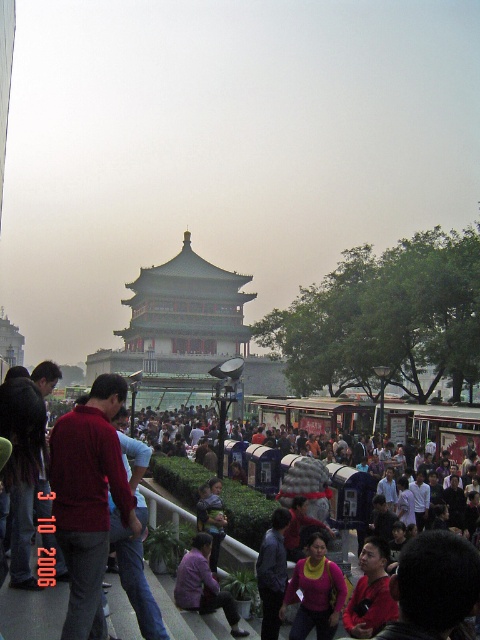
Question: Considering the relative positions of matte pink sweater at center and purple fabric shirt at lower center in the image provided, where is matte pink sweater at center located with respect to purple fabric shirt at lower center?

Choices:
 (A) right
 (B) left

Answer: (A)

Question: Does matte pink sweater at center come behind dark blue jacket at center?

Choices:
 (A) yes
 (B) no

Answer: (B)

Question: Which of the following is the closest to the observer?

Choices:
 (A) (282, 509)
 (B) (356, 586)
 (C) (308, 602)

Answer: (C)

Question: Among these points, which one is farthest from the camera?

Choices:
 (A) (360, 609)
 (B) (180, 596)

Answer: (B)

Question: Does matte pink sweater at center appear under dark blue jacket at center?

Choices:
 (A) no
 (B) yes

Answer: (B)

Question: Which of these objects is positioned closest to the red matte shirt at lower right?

Choices:
 (A) dark blue jacket at center
 (B) purple fabric shirt at lower center
 (C) matte pink sweater at center

Answer: (C)